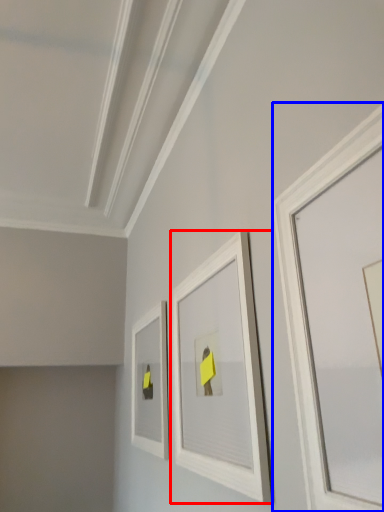
Question: Which of the following is the closest to the observer, picture frame (highlighted by a red box) or picture frame (highlighted by a blue box)?

Choices:
 (A) picture frame
 (B) picture frame

Answer: (B)